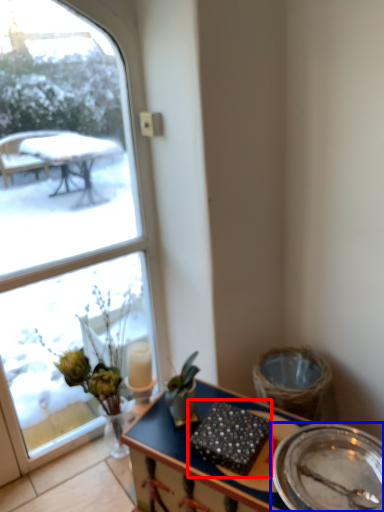
Question: Which object is closer to the camera taking this photo, food (highlighted by a red box) or plate (highlighted by a blue box)?

Choices:
 (A) food
 (B) plate

Answer: (B)